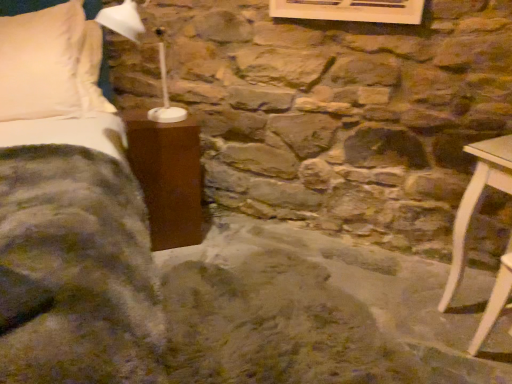
Question: Considering the positions of white wood chair at lower right, which is the first furniture from right to left, and matte brown nightstand at left, which is counted as the first furniture, starting from the top, in the image, is white wood chair at lower right, which is the first furniture from right to left, wider or thinner than matte brown nightstand at left, which is counted as the first furniture, starting from the top,?

Choices:
 (A) thin
 (B) wide

Answer: (A)

Question: Do you think white wood chair at lower right, placed as the first furniture when sorted from front to back, is within matte brown nightstand at left, placed as the 2th furniture when sorted from bottom to top, or outside of it?

Choices:
 (A) inside
 (B) outside

Answer: (B)

Question: Estimate the real-world distances between objects in this image. Which object is farther from the white wood chair at lower right, placed as the first furniture when sorted from front to back?

Choices:
 (A) white plastic table lamp at upper left
 (B) matte brown nightstand at left, which appears as the 1th furniture when viewed from the back
 (C) velvet green blanket at left

Answer: (A)

Question: Estimate the real-world distances between objects in this image. Which object is closer to the matte brown nightstand at left, placed as the 2th furniture when sorted from bottom to top?

Choices:
 (A) white plastic table lamp at upper left
 (B) white wood chair at lower right, the second furniture viewed from the left
 (C) velvet green blanket at left

Answer: (C)